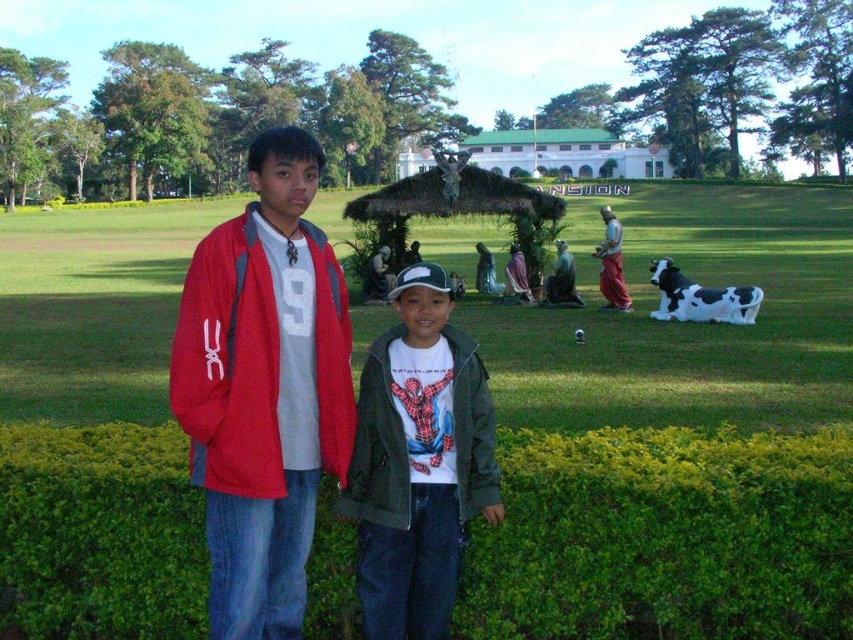
You are standing in the outdoor scene and want to find the green textured jacket at center. Based on the coordinates provided, is it closer to the left or right side of the image?

The green textured jacket at center is located at point 0.723 on the x axis, which is closer to the right side of the image since the x axis ranges from 0 on the left to 1 on the right.